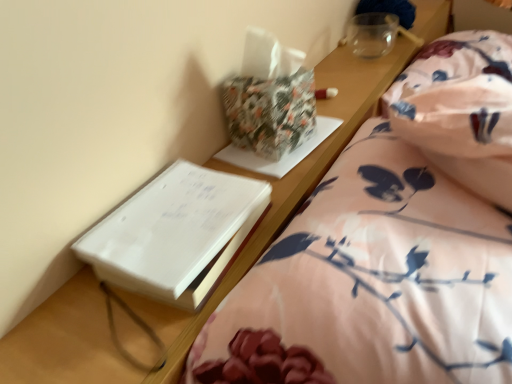
The height and width of the screenshot is (384, 512). Describe the element at coordinates (175, 233) in the screenshot. I see `white paper at left` at that location.

At what (x,y) coordinates should I click in order to perform the action: click on floral cotton blanket at right. Please return your answer as a coordinate pair (x, y). The image size is (512, 384). Looking at the image, I should click on (461, 109).

Is white paper at left next to floral-patterned paper at upper center?

No, white paper at left is not touching floral-patterned paper at upper center.

Visually, is white paper at left positioned to the left or to the right of floral-patterned paper at upper center?

white paper at left is positioned on floral-patterned paper at upper center's left side.

From the image's perspective, is white paper at left above or below floral-patterned paper at upper center?

white paper at left is situated lower than floral-patterned paper at upper center in the image.

How different are the orientations of white paper at left and floral-patterned paper at upper center in degrees?

4.2 degrees separate the facing orientations of white paper at left and floral-patterned paper at upper center.

Is floral cotton blanket at right oriented away from floral fabric bed at lower right?

floral cotton blanket at right is not turned away from floral fabric bed at lower right.

From a real-world perspective, is floral cotton blanket at right physically above floral fabric bed at lower right?

No.

Based on their positions, is floral cotton blanket at right located to the left or right of floral fabric bed at lower right?

Clearly, floral cotton blanket at right is on the right of floral fabric bed at lower right in the image.

In the scene shown: How distant is floral cotton blanket at right from floral fabric bed at lower right?

18.70 inches.

In terms of size, does white paper at left appear bigger or smaller than floral cotton blanket at right?

white paper at left is smaller than floral cotton blanket at right.

What's the angular difference between white paper at left and floral cotton blanket at right's facing directions?

0.67 degrees separate the facing orientations of white paper at left and floral cotton blanket at right.

Is white paper at left facing away from floral cotton blanket at right?

white paper at left does not have its back to floral cotton blanket at right.

Choose the correct answer: Is floral cotton blanket at right inside white paper at left or outside it?

floral cotton blanket at right is outside white paper at left.

How many degrees apart are the facing directions of floral cotton blanket at right and white paper at left?

The facing directions of floral cotton blanket at right and white paper at left are 0.67 degrees apart.

Considering the relative positions of floral cotton blanket at right and white paper at left in the image provided, is floral cotton blanket at right to the right of white paper at left from the viewer's perspective?

Yes, floral cotton blanket at right is to the right of white paper at left.

Is floral cotton blanket at right oriented away from white paper at left?

No, white paper at left is not at the back of floral cotton blanket at right.

Does floral fabric bed at lower right turn towards floral cotton blanket at right?

No, floral fabric bed at lower right is not aimed at floral cotton blanket at right.

Which is closer, (483, 115) or (468, 174)?

Point (483, 115)

From a real-world perspective, who is located higher, floral fabric bed at lower right or floral cotton blanket at right?

floral fabric bed at lower right, from a real-world perspective.

Considering the relative sizes of floral fabric bed at lower right and white paper at left in the image provided, is floral fabric bed at lower right shorter than white paper at left?

No, floral fabric bed at lower right is not shorter than white paper at left.

Does floral fabric bed at lower right turn towards white paper at left?

No.

Find the location of a particular element. bed located underneath the white paper at left (from a real-world perspective) is located at coordinates (394, 242).

Between floral fabric bed at lower right and white paper at left, which one appears on the right side from the viewer's perspective?

Positioned to the right is floral fabric bed at lower right.

Considering the sizes of floral-patterned paper at upper center and floral fabric bed at lower right in the image, is floral-patterned paper at upper center taller or shorter than floral fabric bed at lower right?

Clearly, floral-patterned paper at upper center is shorter compared to floral fabric bed at lower right.

Is floral-patterned paper at upper center positioned in front of floral fabric bed at lower right?

No.

Is floral-patterned paper at upper center wider or thinner than floral fabric bed at lower right?

Considering their sizes, floral-patterned paper at upper center looks slimmer than floral fabric bed at lower right.

Would you say floral fabric bed at lower right is part of floral-patterned paper at upper center's contents?

Definitely not — floral fabric bed at lower right is not inside floral-patterned paper at upper center.

What are the coordinates of `package that appears behind the white paper at left` in the screenshot? It's located at (270, 98).

This screenshot has height=384, width=512. In order to click on blanket to the right of floral fabric bed at lower right in this screenshot , I will do `click(461, 109)`.

When comparing their distances from floral fabric bed at lower right, does floral-patterned paper at upper center or white paper at left seem closer?

white paper at left is positioned closer to the anchor floral fabric bed at lower right.

Estimate the real-world distances between objects in this image. Which object is closer to floral cotton blanket at right, floral fabric bed at lower right or white paper at left?

floral fabric bed at lower right is closer to floral cotton blanket at right.

When comparing their distances from floral fabric bed at lower right, does floral-patterned paper at upper center or floral cotton blanket at right seem further?

floral cotton blanket at right is further to floral fabric bed at lower right.

From the image, which object appears to be nearer to floral cotton blanket at right, white paper at left or floral fabric bed at lower right?

floral fabric bed at lower right is positioned closer to the anchor floral cotton blanket at right.

Considering their positions, is floral fabric bed at lower right positioned closer to white paper at left than floral-patterned paper at upper center?

Based on the image, floral fabric bed at lower right appears to be nearer to white paper at left.

Based on their spatial positions, is floral fabric bed at lower right or floral-patterned paper at upper center further from floral cotton blanket at right?

floral fabric bed at lower right lies further to floral cotton blanket at right than the other object.

In the scene shown: Which object lies further to the anchor point floral fabric bed at lower right, floral cotton blanket at right or floral-patterned paper at upper center?

floral cotton blanket at right.

From the image, which object appears to be farther from floral cotton blanket at right, floral-patterned paper at upper center or white paper at left?

white paper at left is positioned further to the anchor floral cotton blanket at right.

Where is `paperback book between floral fabric bed at lower right and floral-patterned paper at upper center in the front-back direction`? This screenshot has width=512, height=384. paperback book between floral fabric bed at lower right and floral-patterned paper at upper center in the front-back direction is located at coordinates (175, 233).

Where is `bed between white paper at left and floral cotton blanket at right`? bed between white paper at left and floral cotton blanket at right is located at coordinates (394, 242).

Identify the location of package located between floral fabric bed at lower right and floral cotton blanket at right in the depth direction. (270, 98).

Locate an element on the screen. This screenshot has width=512, height=384. package located between white paper at left and floral cotton blanket at right in the left-right direction is located at coordinates (270, 98).